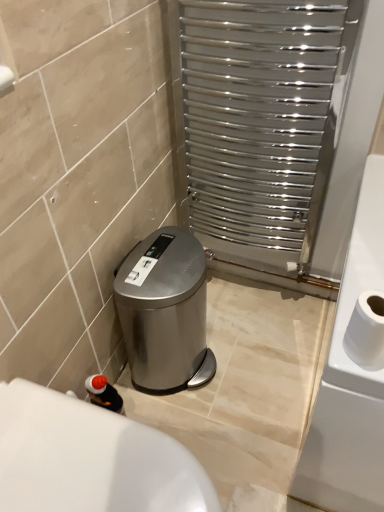
Question: Is polished stainless steel radiator at upper right wider or thinner than white glossy bath at lower left?

Choices:
 (A) wide
 (B) thin

Answer: (B)

Question: In the image, is polished stainless steel radiator at upper right positioned in front of or behind white glossy bath at lower left?

Choices:
 (A) behind
 (B) front

Answer: (A)

Question: Based on their relative distances, which object is nearer to the white matte toilet paper at right?

Choices:
 (A) satin silver trash can at lower left
 (B) white glossy bath at lower left
 (C) polished stainless steel radiator at upper right

Answer: (B)

Question: Which is nearer to the satin silver trash can at lower left?

Choices:
 (A) polished stainless steel radiator at upper right
 (B) white matte toilet paper at right
 (C) white glossy bath at lower left

Answer: (A)